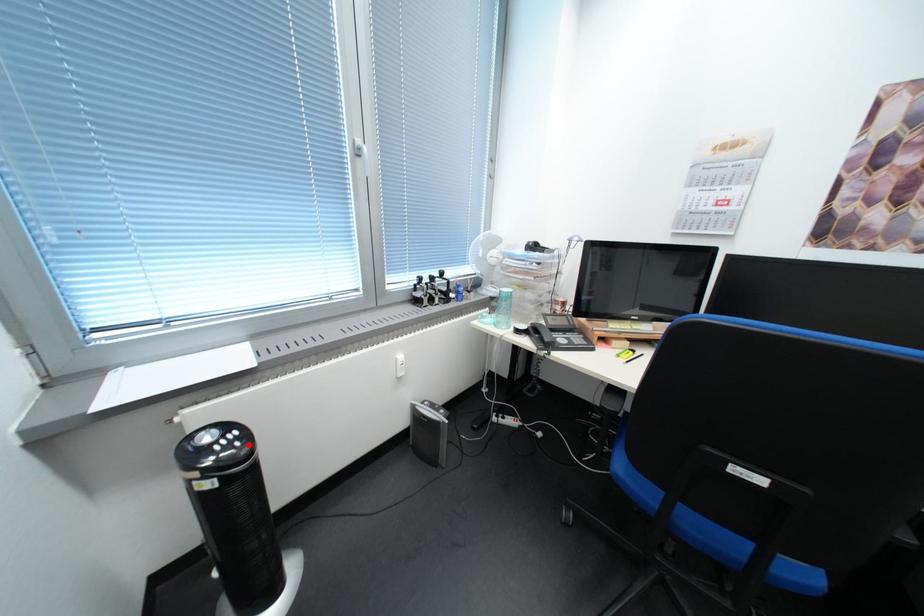
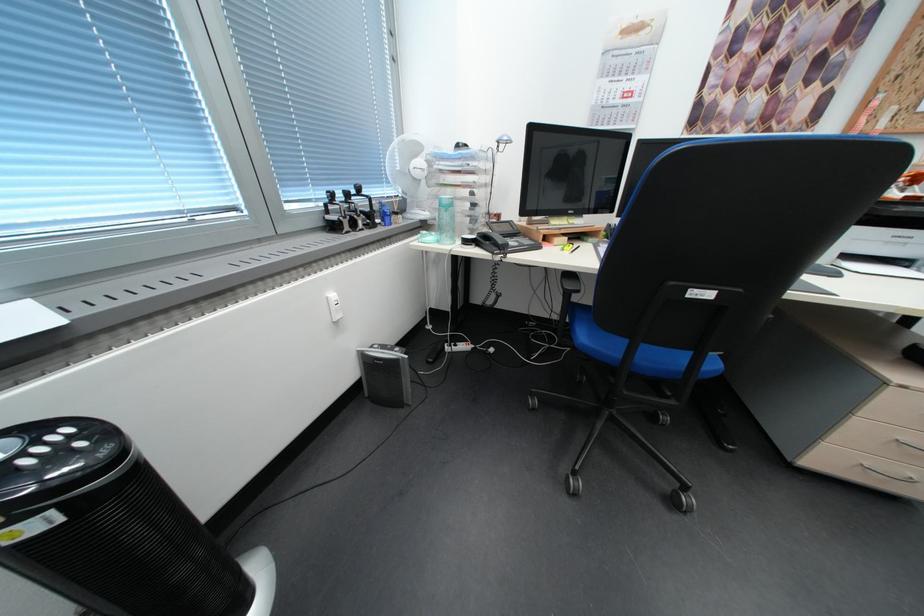
Find the pixel in the second image that matches the highlighted location in the first image.

(91, 446)